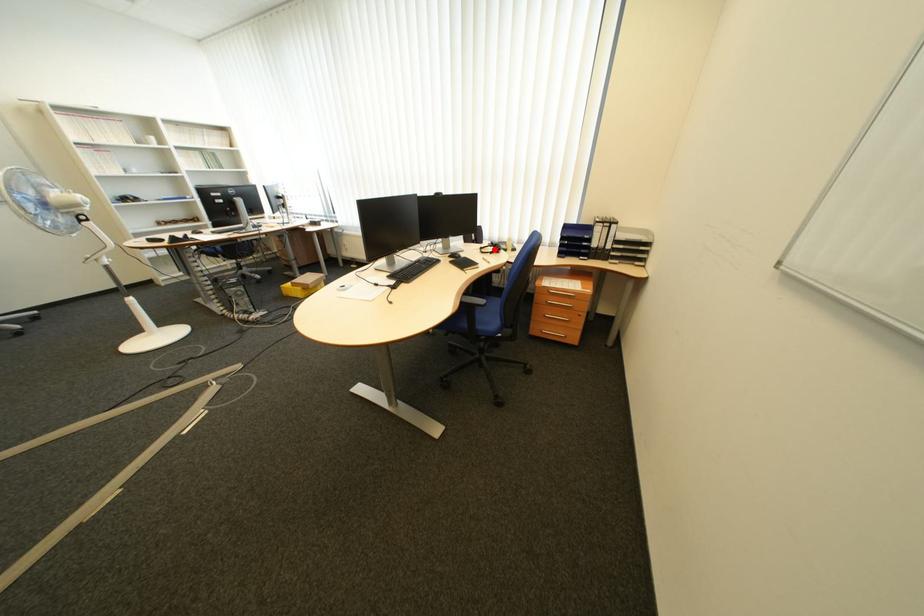
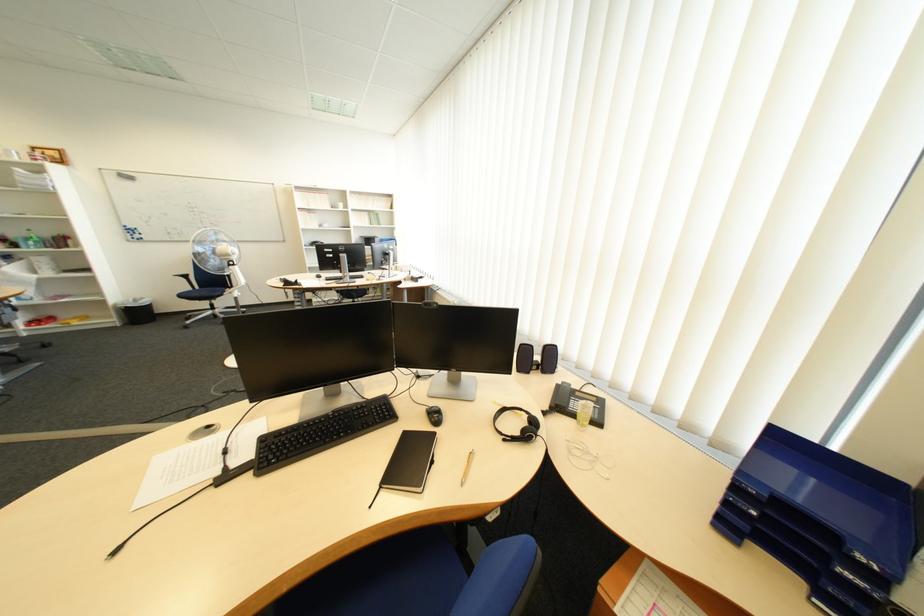
In the second image, find the point that corresponds to the highlighted location in the first image.

(517, 411)